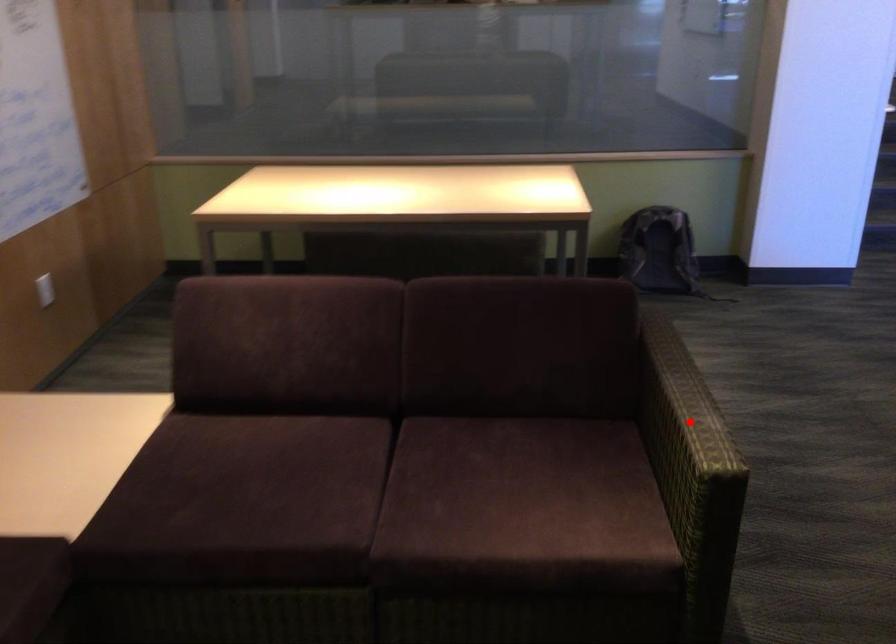
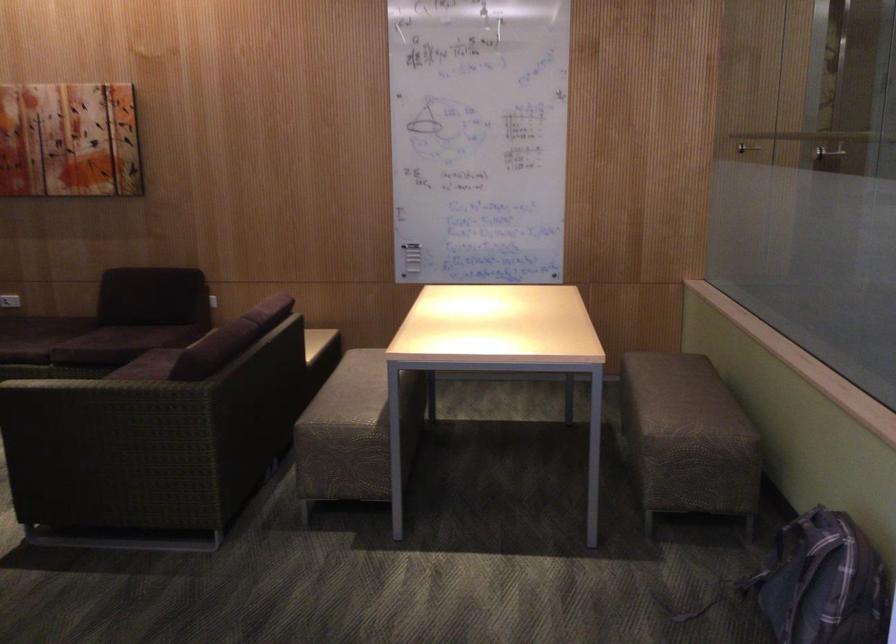
The point at the highlighted location is marked in the first image. Where is the corresponding point in the second image?

(96, 382)